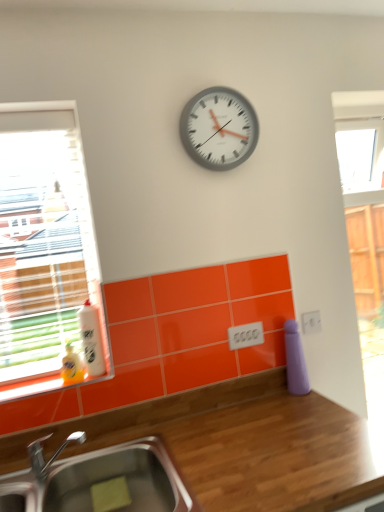
Question: Considering the positions of point click(11, 134) and point click(87, 325), is point click(11, 134) closer or farther from the camera than point click(87, 325)?

Choices:
 (A) farther
 (B) closer

Answer: (B)

Question: Is clear glass window at left bigger or smaller than white glossy bottle at left?

Choices:
 (A) big
 (B) small

Answer: (A)

Question: Considering the real-world distances, which object is closest to the white plastic clock at upper center?

Choices:
 (A) wooden at upper center
 (B) clear glass window at left
 (C) white glossy bottle at left
 (D) stainless steel sink at lower left
 (E) orange glossy window sill at lower left

Answer: (B)

Question: Which is farther from the white glossy bottle at left?

Choices:
 (A) orange glossy window sill at lower left
 (B) wooden at upper center
 (C) white plastic clock at upper center
 (D) stainless steel sink at lower left
 (E) clear glass window at left

Answer: (C)